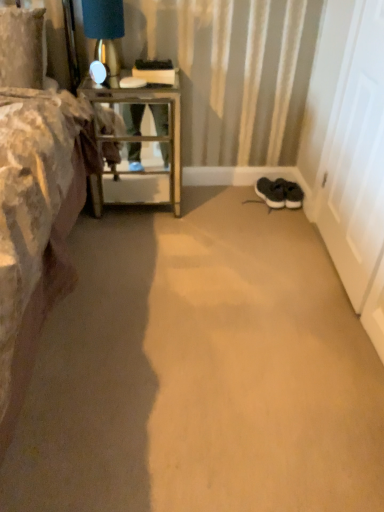
Where is `vacant space underneath metallic glass table at left (from a real-world perspective)`? The height and width of the screenshot is (512, 384). vacant space underneath metallic glass table at left (from a real-world perspective) is located at coordinates (139, 211).